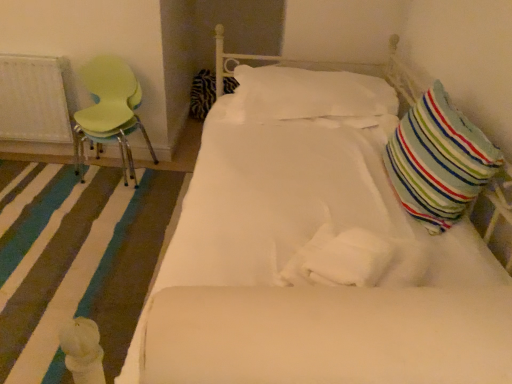
Where is `vacant space in front of light green plastic chair at left`? vacant space in front of light green plastic chair at left is located at coordinates [91, 209].